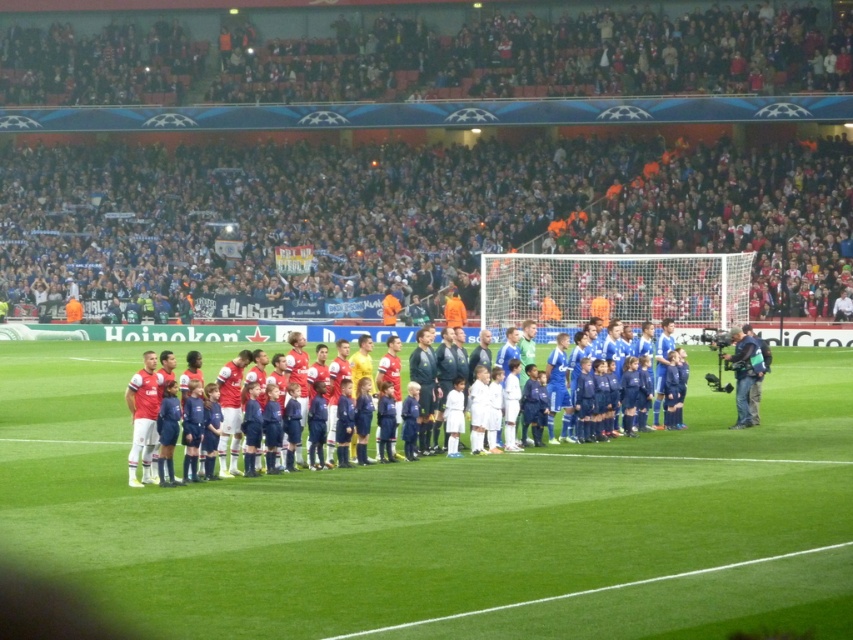
Is green grass football field at center below black fabric camera at right?

Yes.

Is point (291, 557) in front of point (723, 356)?

Yes.

Find the location of `green grass football field at center`. green grass football field at center is located at coordinates (447, 520).

Between point (751, 337) and point (496, 368), which one is positioned behind?

Point (751, 337)

Can you confirm if black fabric camera at right is positioned below blue fabric jersey at center?

Yes.

What do you see at coordinates (744, 372) in the screenshot?
I see `black fabric camera at right` at bounding box center [744, 372].

This screenshot has height=640, width=853. In order to click on black fabric camera at right in this screenshot , I will do `click(744, 372)`.

Who is higher up, green grass football field at center or blue fabric jersey at center?

blue fabric jersey at center

Does green grass football field at center have a lesser width compared to blue fabric jersey at center?

No.

Where is `green grass football field at center`? The image size is (853, 640). green grass football field at center is located at coordinates (447, 520).

You are a GUI agent. You are given a task and a screenshot of the screen. Output one action in this format:
    pyautogui.click(x=<x>, y=<y>)
    Task: Click on the green grass football field at center
    The width and height of the screenshot is (853, 640).
    Given the screenshot: What is the action you would take?
    pyautogui.click(x=447, y=520)